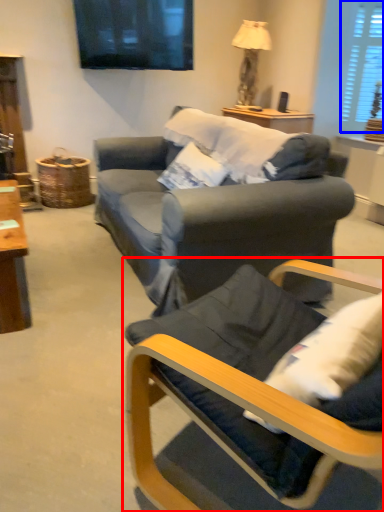
Question: Which of the following is the farthest to the observer, chair (highlighted by a red box) or window (highlighted by a blue box)?

Choices:
 (A) chair
 (B) window

Answer: (B)